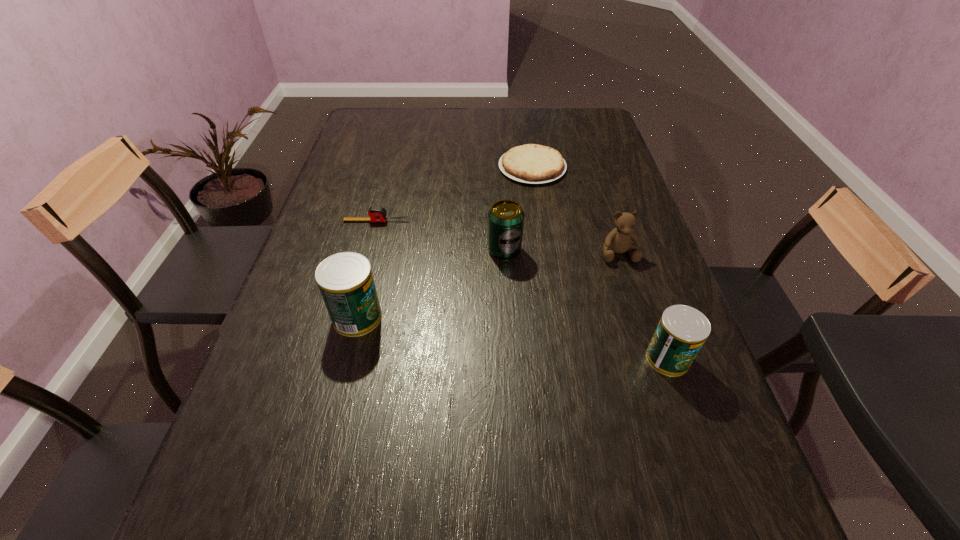
Identify the location of vacant space located on the back of the left can. (367, 278).

This screenshot has width=960, height=540. I want to click on vacant space located 0.230m on the back of the nearer can, so click(636, 266).

Find the location of `vacant space situated 0.150m on the back of the farthest object`. vacant space situated 0.150m on the back of the farthest object is located at coordinates (526, 129).

In order to click on blank area located on the front-facing side of the teddy bear in this screenshot , I will do click(x=668, y=408).

Locate an element on the screen. The height and width of the screenshot is (540, 960). vacant space located 0.100m on the right of the fifth tallest object is located at coordinates (444, 221).

Find the location of a particular element. The image size is (960, 540). vacant region located on the front of the beer can is located at coordinates (510, 335).

Where is `can that is at the left edge`? can that is at the left edge is located at coordinates (345, 280).

At what (x,y) coordinates should I click in order to perform the action: click on tape measure located at the left edge. Please return your answer as a coordinate pair (x, y). The height and width of the screenshot is (540, 960). Looking at the image, I should click on (377, 214).

Find the location of a particular element. This screenshot has height=540, width=960. can that is at the right edge is located at coordinates (682, 330).

Find the location of a particular element. teddy bear present at the right edge is located at coordinates (618, 240).